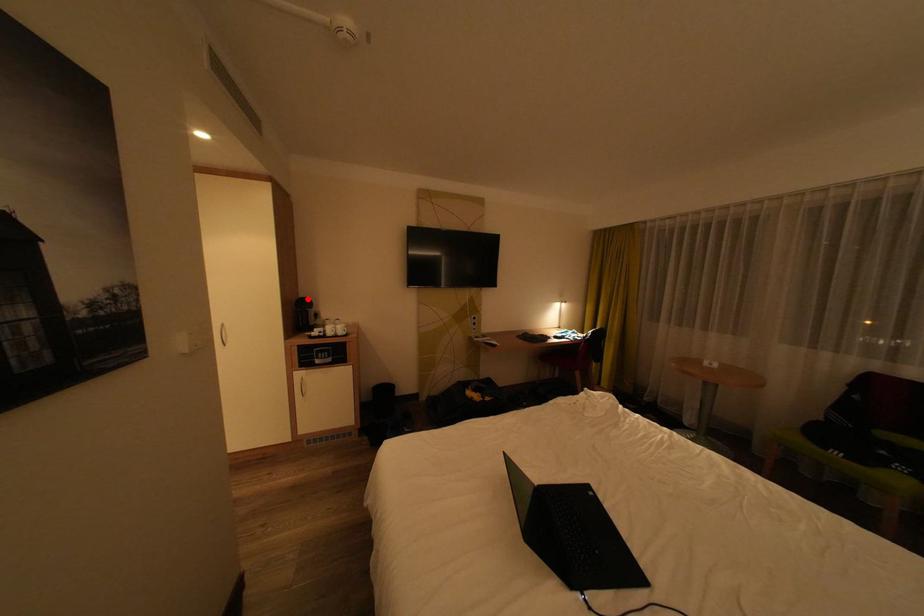
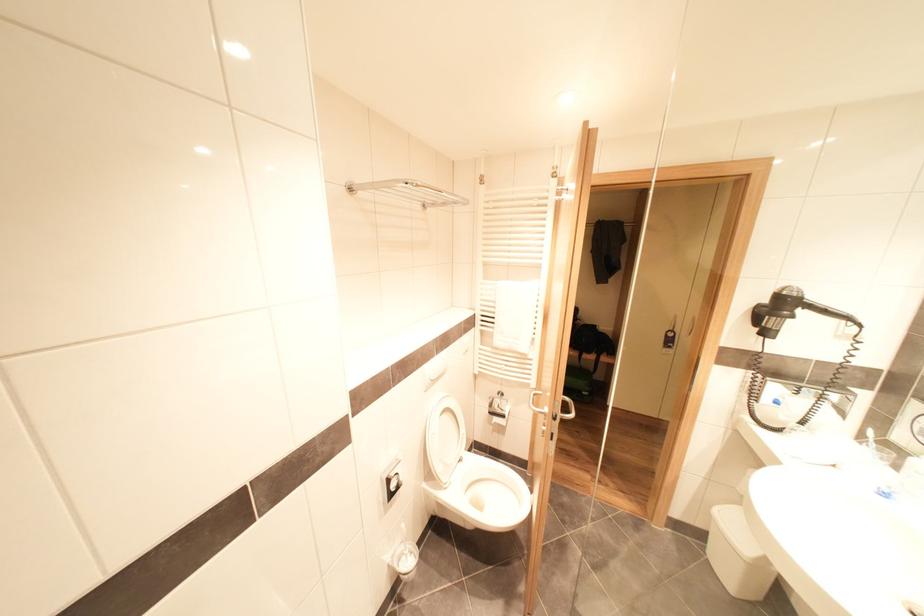
Question: I am providing you with two images of the same scene from different viewpoints. A red point is marked on the first image. Is the red point's position out of view in image 2?

Choices:
 (A) Yes
 (B) No

Answer: (A)